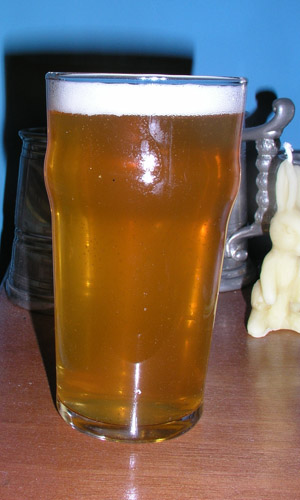
Find the location of `beer in glass`. beer in glass is located at coordinates (155, 235).